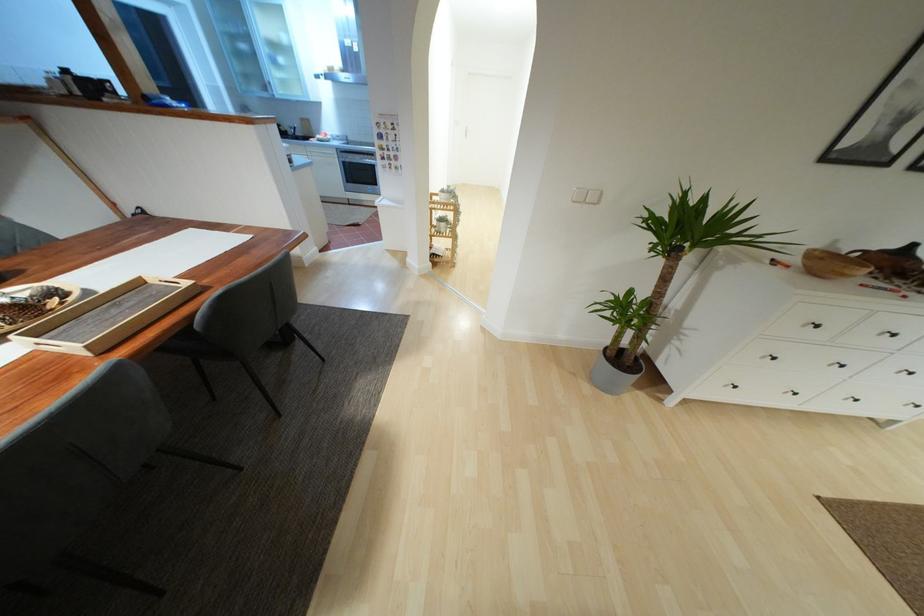
Where would you pull the oven door handle? Please return your answer as a coordinate pair (x, y).

(355, 152)